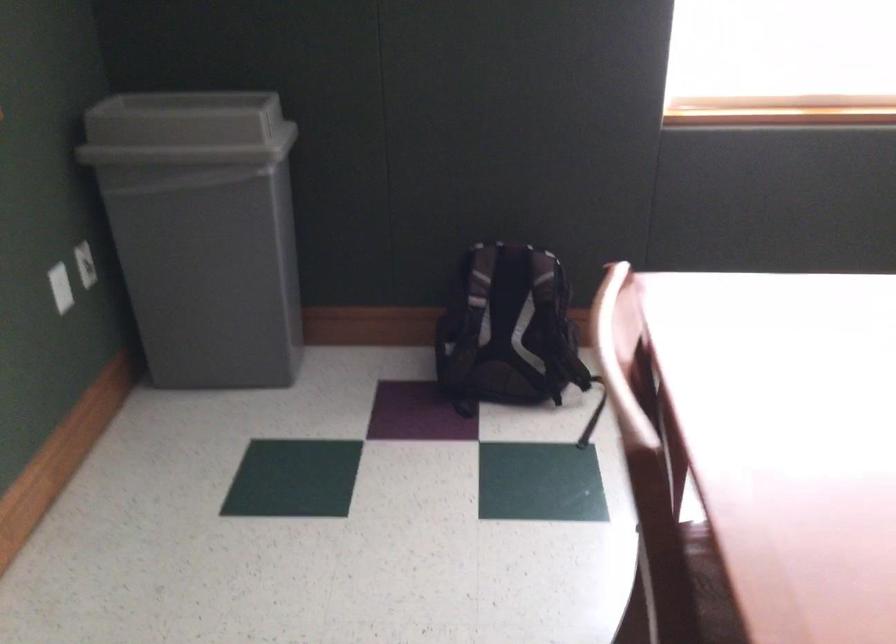
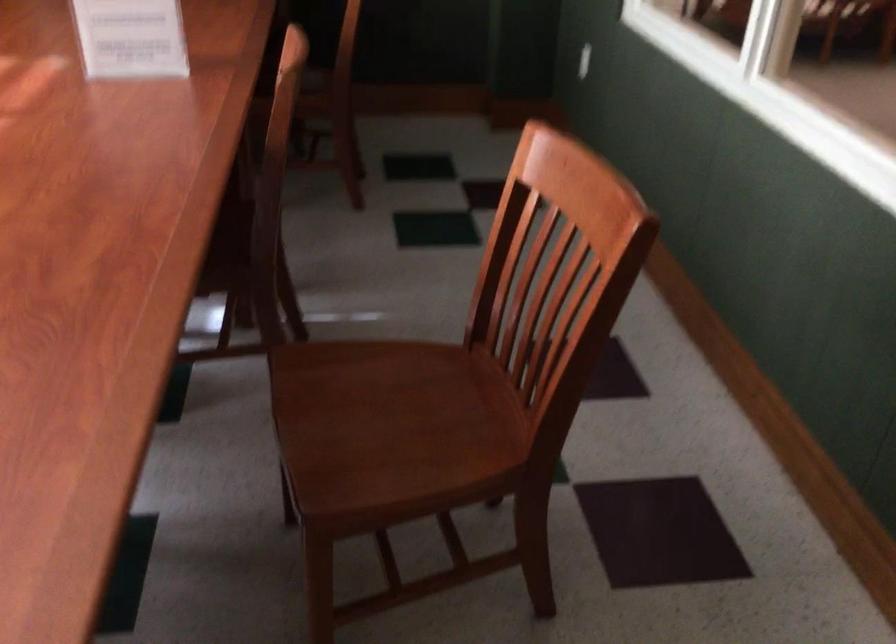
First-person continuous shooting, in which direction is the camera rotating?

The rotation direction of the camera is right-down.